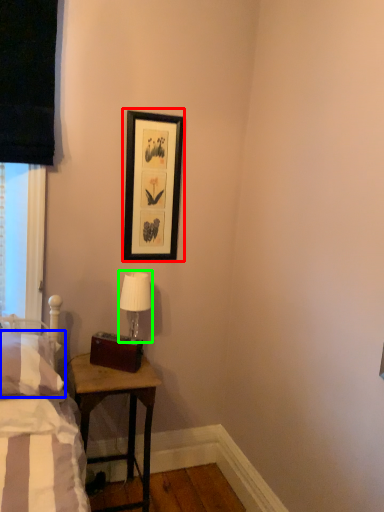
Question: Considering the real-world distances, which object is farthest from picture frame (highlighted by a red box)? pillow (highlighted by a blue box) or table lamp (highlighted by a green box)?

Choices:
 (A) pillow
 (B) table lamp

Answer: (A)